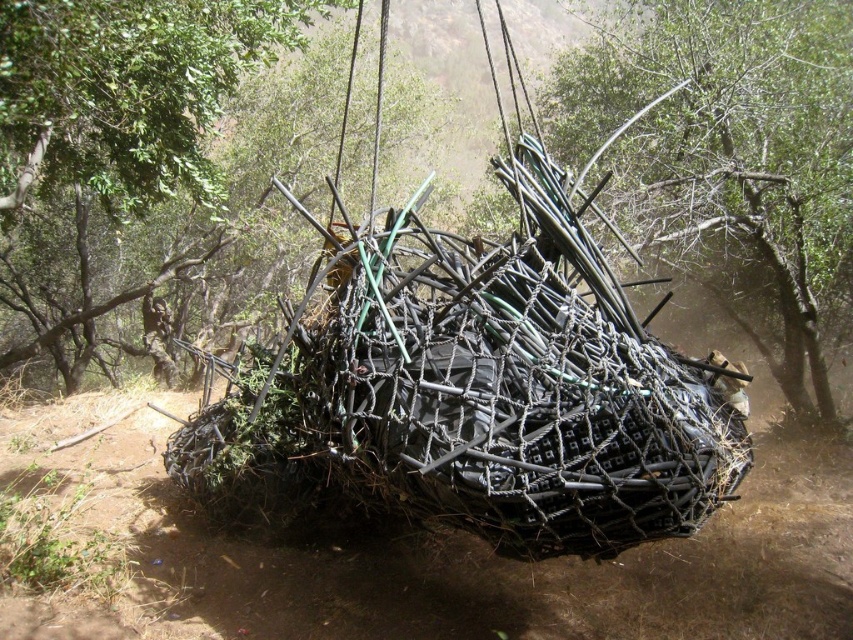
Question: Considering the real-world distances, which object is farthest from the brown dirt track at center?

Choices:
 (A) green matte wire mesh at center
 (B) green matte bamboo at center
 (C) green leafy tree at upper center

Answer: (B)

Question: Where is brown dirt track at center located in relation to green matte wire mesh at center in the image?

Choices:
 (A) below
 (B) above

Answer: (A)

Question: Which object is farther from the camera taking this photo?

Choices:
 (A) green matte bamboo at center
 (B) green matte wire mesh at center

Answer: (A)

Question: Which point is closer to the camera taking this photo?

Choices:
 (A) (173, 99)
 (B) (376, 589)
 (C) (663, 225)

Answer: (B)

Question: Is brown dirt track at center thinner than green matte bamboo at center?

Choices:
 (A) yes
 (B) no

Answer: (B)

Question: Does brown dirt track at center have a greater width compared to green matte bamboo at center?

Choices:
 (A) yes
 (B) no

Answer: (A)